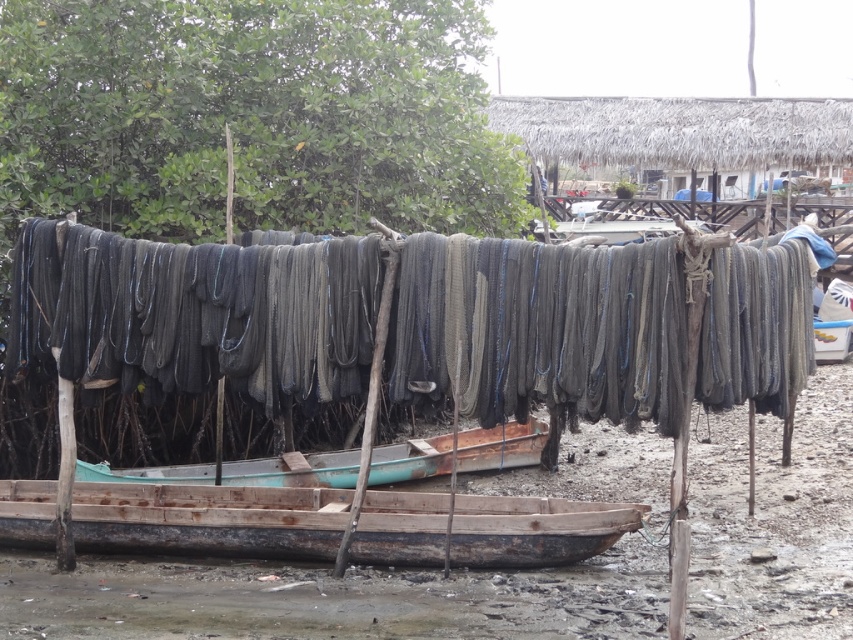
Which is in front, point (357, 586) or point (286, 474)?

Point (357, 586) is in front.

Measure the distance from rusty wooden boat at center to teal wooden canoe at center.

rusty wooden boat at center is 3.12 meters from teal wooden canoe at center.

Between point (790, 592) and point (433, 440), which one is positioned in front?

Point (790, 592)

At what (x,y) coordinates should I click in order to perform the action: click on rusty wooden boat at center. Please return your answer as a coordinate pair (x, y). This screenshot has width=853, height=640. Looking at the image, I should click on (332, 598).

Can you confirm if rusty wood canoe at center is thinner than teal wooden canoe at center?

No, rusty wood canoe at center is not thinner than teal wooden canoe at center.

Is rusty wood canoe at center shorter than teal wooden canoe at center?

Correct, rusty wood canoe at center is not as tall as teal wooden canoe at center.

Describe the element at coordinates (209, 518) in the screenshot. The image size is (853, 640). I see `rusty wood canoe at center` at that location.

Find the location of a particular element. Image resolution: width=853 pixels, height=640 pixels. rusty wood canoe at center is located at coordinates (209, 518).

The image size is (853, 640). What do you see at coordinates (196, 310) in the screenshot?
I see `dark gray netting at center` at bounding box center [196, 310].

Based on the photo, is dark gray netting at center taller than teal wooden canoe at center?

Yes, dark gray netting at center is taller than teal wooden canoe at center.

Locate an element on the screen. This screenshot has width=853, height=640. dark gray netting at center is located at coordinates (196, 310).

Where is `dark gray netting at center`? The width and height of the screenshot is (853, 640). dark gray netting at center is located at coordinates (196, 310).